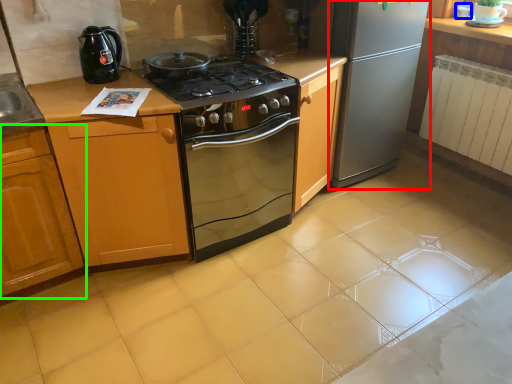
Question: Which is farther away from refrigerator (highlighted by a red box)? appliance (highlighted by a blue box) or cabinetry (highlighted by a green box)?

Choices:
 (A) appliance
 (B) cabinetry

Answer: (B)